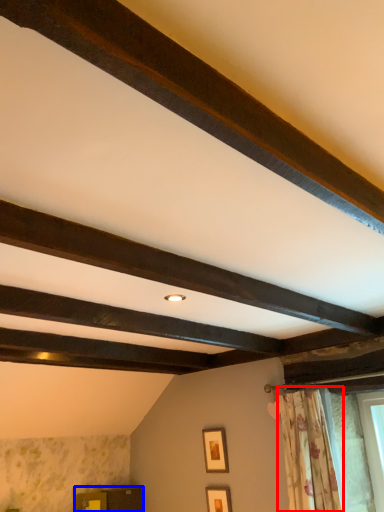
Question: Which object appears closest to the camera in this image, curtain (highlighted by a red box) or furniture (highlighted by a blue box)?

Choices:
 (A) curtain
 (B) furniture

Answer: (A)